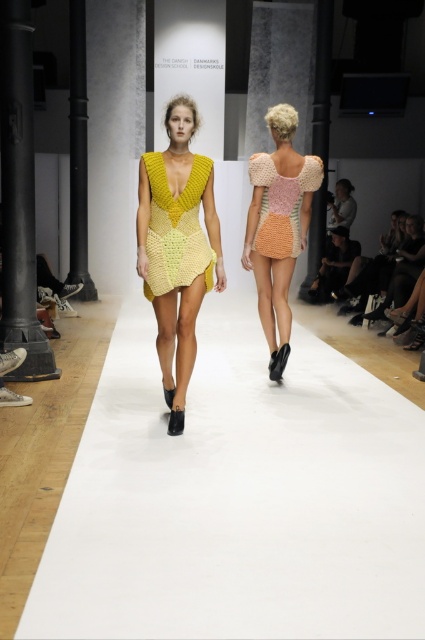
Between point (258, 307) and point (195, 244), which one is positioned in front?

Point (195, 244) is in front.

Does point (289, 328) lie in front of point (190, 195)?

No, it is behind (190, 195).

Image resolution: width=425 pixels, height=640 pixels. I want to click on knitted fabric dress at center, so click(278, 227).

Between black metal pole at left and textured crochet dress at back, which one appears on the left side from the viewer's perspective?

black metal pole at left is more to the left.

Does black metal pole at left lie behind textured crochet dress at back?

Yes.

Does point (25, 81) come behind point (272, 161)?

Yes, point (25, 81) is farther from viewer.

Find the location of a particular element. Image resolution: width=425 pixels, height=640 pixels. black metal pole at left is located at coordinates (19, 195).

Can you confirm if yellow knitted dress at center is positioned below yellow crocheted dress at center?

Correct, yellow knitted dress at center is located below yellow crocheted dress at center.

Is yellow knitted dress at center taller than yellow crocheted dress at center?

Yes.

Which is in front, point (164, 280) or point (195, 266)?

Point (195, 266) is more forward.

What are the coordinates of `yellow knitted dress at center` in the screenshot? It's located at pyautogui.click(x=176, y=248).